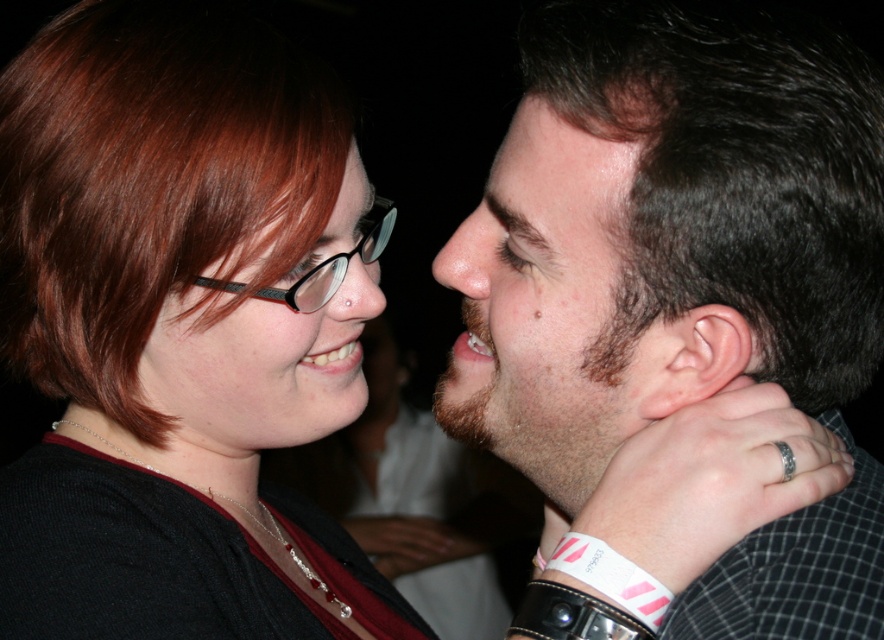
You are a photographer trying to adjust the lighting for a portrait. You notice the dark brown hair at center and the matte black glasses at upper left in your frame. Based on their positions, which object is closer to the right side of the photo?

The dark brown hair at center is to the right of the matte black glasses at upper left, so it is closer to the right side of the photo.

You are a photographer adjusting the focus on your camera. You need to ensure that the brown hair at right is in sharp focus. Given that the focus point is set at point (539, 294), is the focus correctly positioned?

Yes, the focus point at (539, 294) correctly corresponds to the brown hair at right.

In the scene, you notice the brown hair at right and the pale skin ear at right. Which one is positioned higher up?

The brown hair at right is above the pale skin ear at right, so it is positioned higher up.